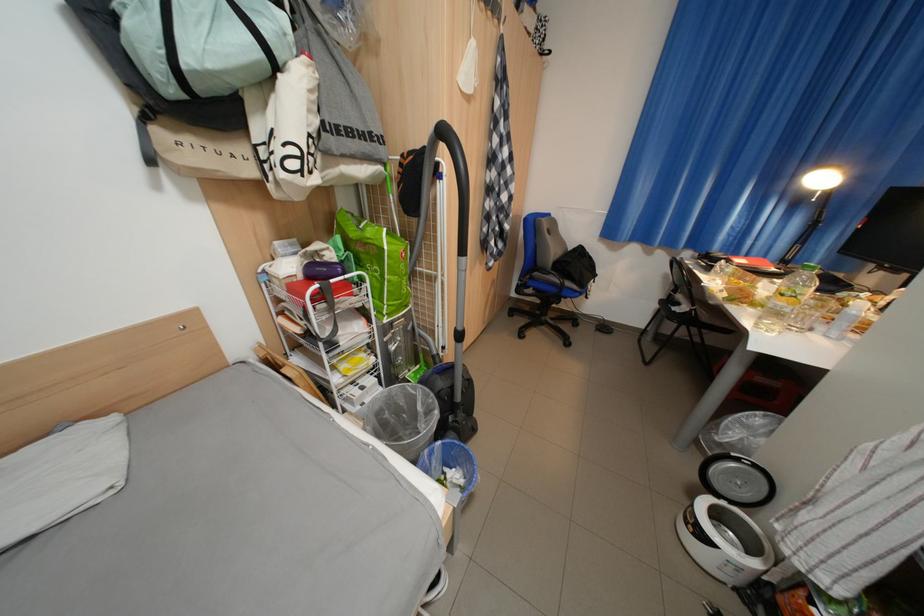
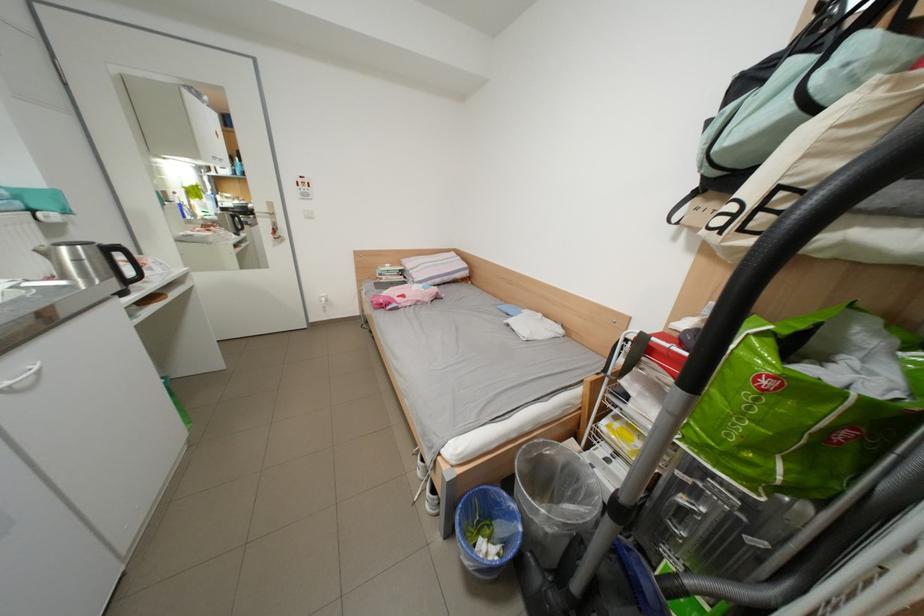
The point at (x=272, y=55) is marked in the first image. Where is the corresponding point in the second image?

(801, 111)